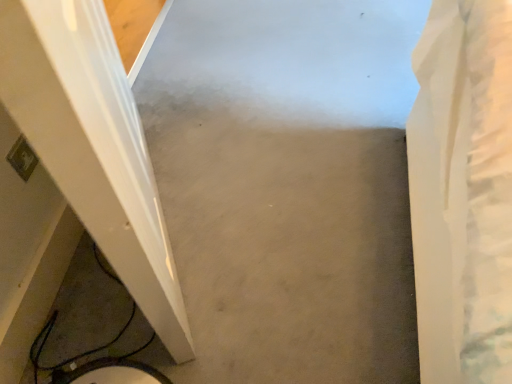
Describe the element at coordinates (93, 145) in the screenshot. The width and height of the screenshot is (512, 384). I see `white glossy door at left` at that location.

At what (x,y) coordinates should I click in order to perform the action: click on white glossy door at left. Please return your answer as a coordinate pair (x, y). The width and height of the screenshot is (512, 384). Looking at the image, I should click on (93, 145).

Where is `white glossy door at left`? This screenshot has height=384, width=512. white glossy door at left is located at coordinates (93, 145).